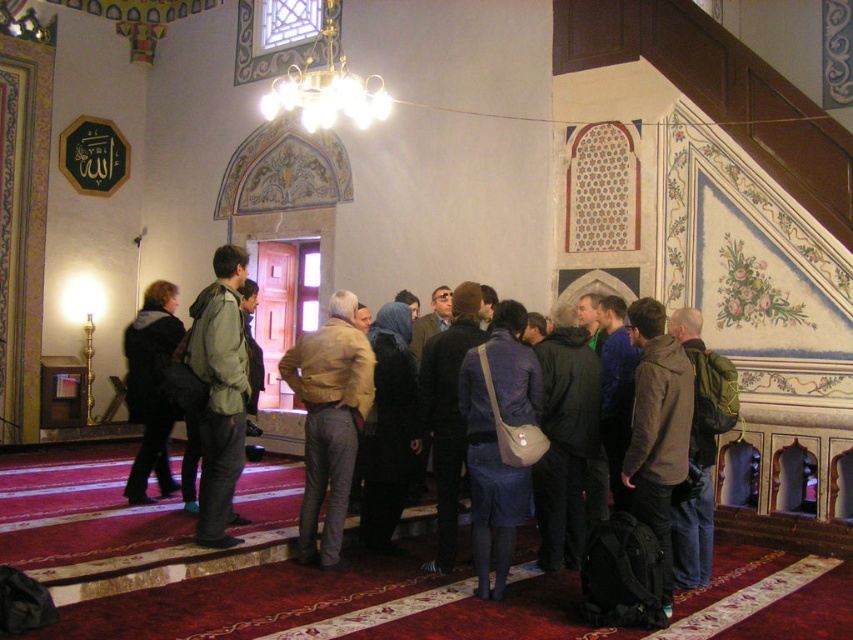
Can you confirm if green matte jacket at center is taller than gold metallic chandelier at upper center?

Indeed, green matte jacket at center has a greater height compared to gold metallic chandelier at upper center.

Which of these two, green matte jacket at center or gold metallic chandelier at upper center, stands taller?

With more height is green matte jacket at center.

Between point (236, 273) and point (334, 4), which one is positioned behind?

The point (334, 4) is behind.

Find the location of a particular element. The width and height of the screenshot is (853, 640). green matte jacket at center is located at coordinates (219, 392).

Which is below, dark blue fabric headscarf at center or green backpack at center?

Positioned lower is green backpack at center.

Does dark blue fabric headscarf at center appear over green backpack at center?

Correct, dark blue fabric headscarf at center is located above green backpack at center.

Find the location of a particular element. dark blue fabric headscarf at center is located at coordinates (387, 428).

Who is more forward, (369, 538) or (343, 108)?

Point (369, 538) is in front.

Which is in front, point (399, 381) or point (292, 90)?

Point (399, 381) is more forward.

The width and height of the screenshot is (853, 640). Find the location of `dark blue fabric headscarf at center`. dark blue fabric headscarf at center is located at coordinates (387, 428).